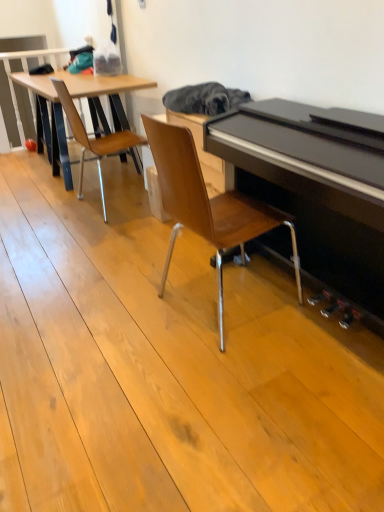
You are a GUI agent. You are given a task and a screenshot of the screen. Output one action in this format:
    pyautogui.click(x=<x>, y=<y>)
    Task: Click on the vacant space underneath wooden chair at center, which appears as the 2th chair when viewed from the back (from a real-world perspective)
    This screenshot has height=512, width=384.
    Given the screenshot: What is the action you would take?
    pyautogui.click(x=225, y=300)